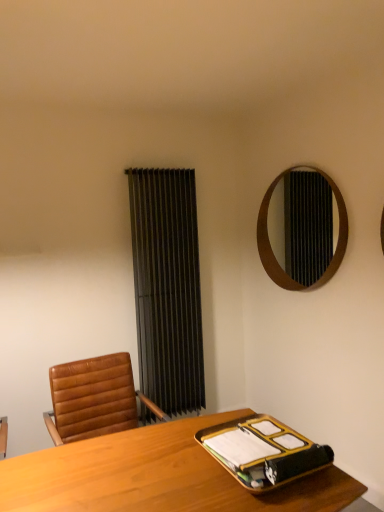
Question: From a real-world perspective, is light wood desk at center on top of gold metallic binder at lower right?

Choices:
 (A) yes
 (B) no

Answer: (B)

Question: Can you see light wood desk at center touching gold metallic binder at lower right?

Choices:
 (A) yes
 (B) no

Answer: (B)

Question: Can you confirm if light wood desk at center is positioned to the right of gold metallic binder at lower right?

Choices:
 (A) no
 (B) yes

Answer: (A)

Question: Is light wood desk at center not within gold metallic binder at lower right?

Choices:
 (A) no
 (B) yes

Answer: (B)

Question: Considering the relative positions of light wood desk at center and gold metallic binder at lower right in the image provided, is light wood desk at center to the left of gold metallic binder at lower right from the viewer's perspective?

Choices:
 (A) no
 (B) yes

Answer: (B)

Question: Looking at the image, does light wood desk at center seem bigger or smaller compared to black fabric curtain at center?

Choices:
 (A) small
 (B) big

Answer: (B)

Question: Is light wood desk at center wider or thinner than black fabric curtain at center?

Choices:
 (A) thin
 (B) wide

Answer: (B)

Question: Relative to black fabric curtain at center, is light wood desk at center in front or behind?

Choices:
 (A) behind
 (B) front

Answer: (B)

Question: In terms of height, does light wood desk at center look taller or shorter compared to black fabric curtain at center?

Choices:
 (A) tall
 (B) short

Answer: (B)

Question: Is point (274, 443) positioned closer to the camera than point (271, 256)?

Choices:
 (A) farther
 (B) closer

Answer: (B)

Question: In terms of width, does gold metallic binder at lower right look wider or thinner when compared to wooden mirror at upper right?

Choices:
 (A) wide
 (B) thin

Answer: (A)

Question: From the image's perspective, relative to wooden mirror at upper right, is gold metallic binder at lower right above or below?

Choices:
 (A) above
 (B) below

Answer: (B)

Question: From a real-world perspective, is gold metallic binder at lower right positioned above or below wooden mirror at upper right?

Choices:
 (A) below
 (B) above

Answer: (A)

Question: Is gold metallic binder at lower right in front of or behind light wood desk at center in the image?

Choices:
 (A) front
 (B) behind

Answer: (B)

Question: Considering the positions of gold metallic binder at lower right and light wood desk at center in the image, is gold metallic binder at lower right bigger or smaller than light wood desk at center?

Choices:
 (A) small
 (B) big

Answer: (A)